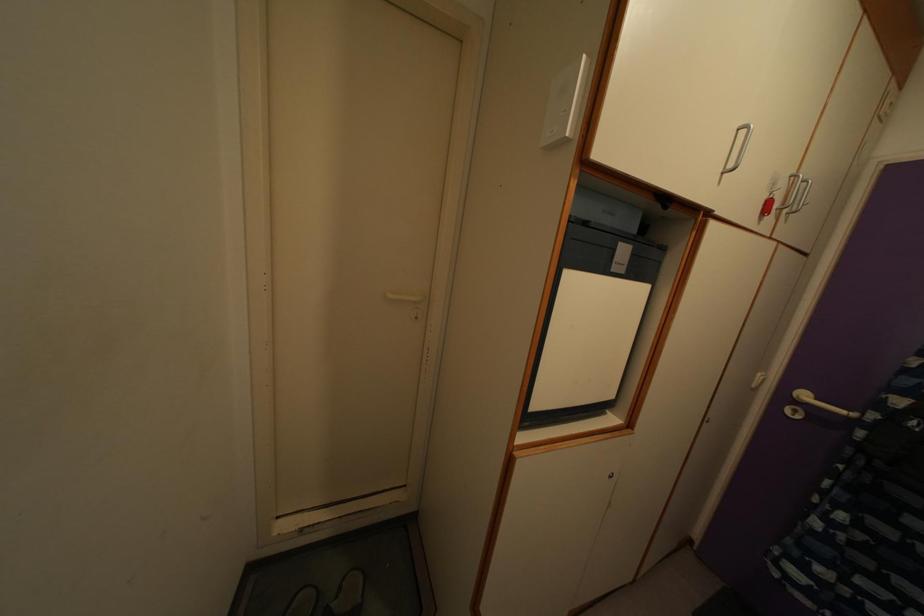
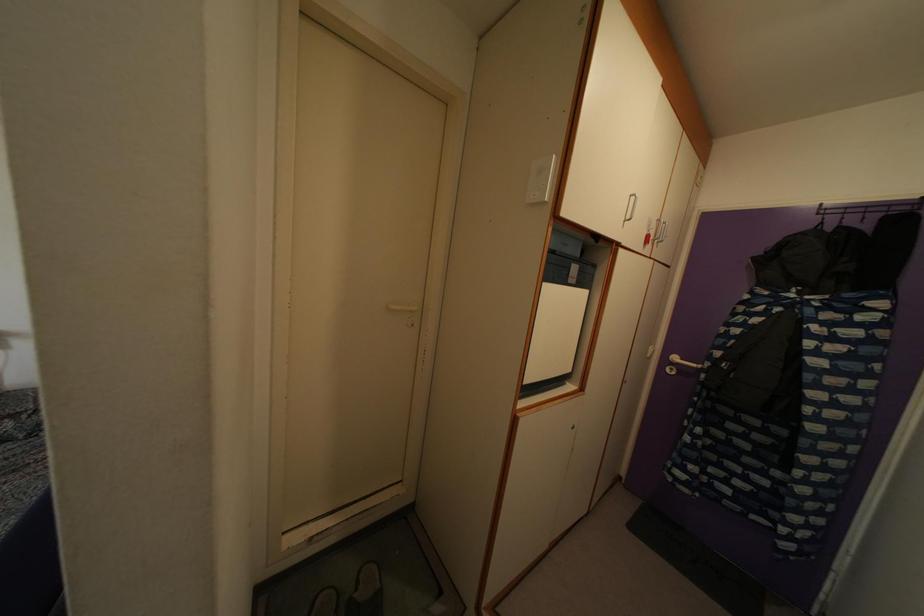
Locate, in the second image, the point that corresponds to the point at 796,185 in the first image.

(662, 229)